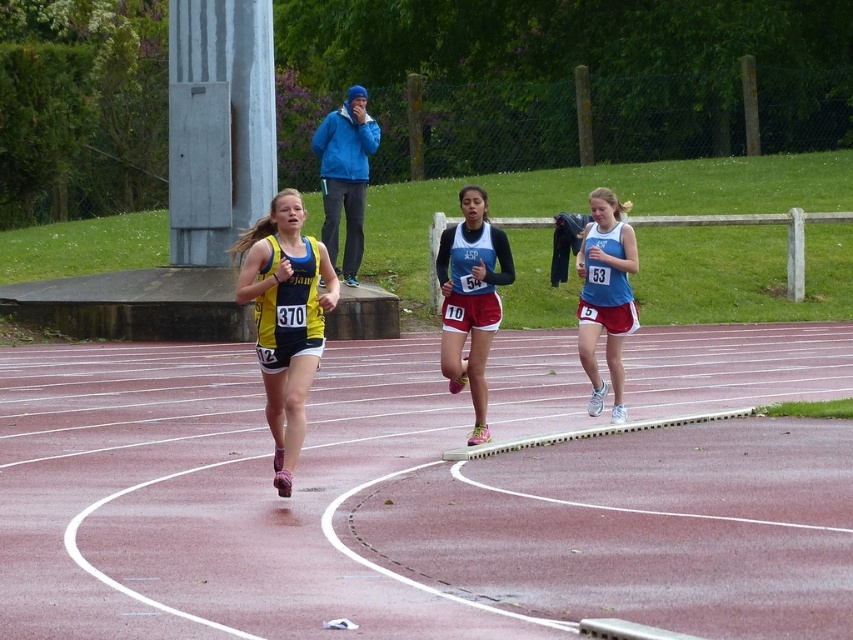
Who is shorter, pink rubber track at center or matte blue tank top at center?

pink rubber track at center

Does pink rubber track at center appear on the right side of matte blue tank top at center?

No, pink rubber track at center is not to the right of matte blue tank top at center.

Which is in front, point (827, 484) or point (604, 189)?

Point (827, 484) is more forward.

Locate an element on the screen. The width and height of the screenshot is (853, 640). pink rubber track at center is located at coordinates (392, 509).

Who is shorter, yellow fabric running suit at center or matte black and red running uniform at center?

Standing shorter between the two is matte black and red running uniform at center.

Does point (283, 202) come closer to viewer compared to point (485, 417)?

Yes, point (283, 202) is closer to viewer.

Describe the element at coordinates (285, 317) in the screenshot. I see `yellow fabric running suit at center` at that location.

Identify the location of yellow fabric running suit at center. (285, 317).

Between yellow fabric running suit at center and matte blue tank top at center, which one is positioned lower?

Positioned lower is yellow fabric running suit at center.

Can you confirm if yellow fabric running suit at center is positioned to the right of matte blue tank top at center?

No, yellow fabric running suit at center is not to the right of matte blue tank top at center.

Describe the element at coordinates (285, 317) in the screenshot. I see `yellow fabric running suit at center` at that location.

Locate an element on the screen. Image resolution: width=853 pixels, height=640 pixels. yellow fabric running suit at center is located at coordinates (285, 317).